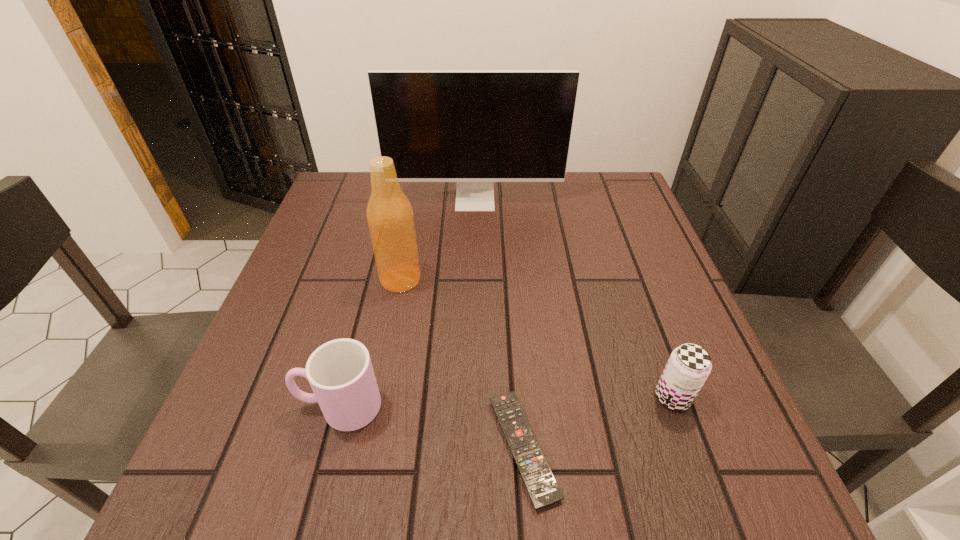
Where is `the farthest object`? the farthest object is located at coordinates (474, 127).

Find the location of `monitor`. monitor is located at coordinates (474, 127).

At what (x,y) coordinates should I click in order to perform the action: click on the second tallest object. Please return your answer as a coordinate pair (x, y). The width and height of the screenshot is (960, 540). Looking at the image, I should click on tap(389, 214).

At what (x,y) coordinates should I click in order to perform the action: click on the fourth nearest object. Please return your answer as a coordinate pair (x, y). The height and width of the screenshot is (540, 960). Looking at the image, I should click on (389, 214).

The width and height of the screenshot is (960, 540). Find the location of `cup`. cup is located at coordinates (340, 372).

Identify the location of beer can. (689, 365).

At what (x,y) coordinates should I click in order to perform the action: click on remote control. Please return your answer as a coordinate pair (x, y). The width and height of the screenshot is (960, 540). Looking at the image, I should click on (536, 473).

Find the location of a particular element. This screenshot has width=960, height=540. free space located 0.320m on the front-facing side of the farthest object is located at coordinates (x=473, y=299).

Find the location of a particular element. The width and height of the screenshot is (960, 540). vacant region located 0.170m on the back of the fourth nearest object is located at coordinates (412, 221).

Find the location of a particular element. free location located on the left of the beer can is located at coordinates (556, 397).